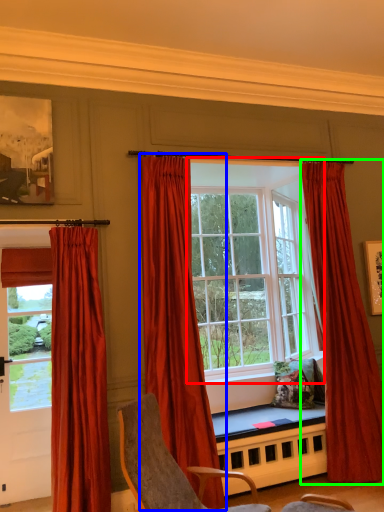
Question: Considering the real-world distances, which object is closest to window (highlighted by a red box)? curtain (highlighted by a blue box) or curtain (highlighted by a green box).

Choices:
 (A) curtain
 (B) curtain

Answer: (B)